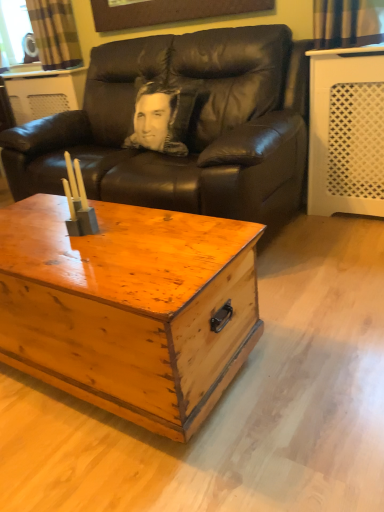
Question: Does wooden chest at center lie in front of black leather couch at center?

Choices:
 (A) yes
 (B) no

Answer: (A)

Question: From the image's perspective, does wooden chest at center appear lower than black leather couch at center?

Choices:
 (A) no
 (B) yes

Answer: (B)

Question: From a real-world perspective, does wooden chest at center stand above black leather couch at center?

Choices:
 (A) no
 (B) yes

Answer: (A)

Question: Is wooden chest at center further to the viewer compared to black leather couch at center?

Choices:
 (A) no
 (B) yes

Answer: (A)

Question: Is wooden chest at center outside of black leather couch at center?

Choices:
 (A) no
 (B) yes

Answer: (B)

Question: Can you confirm if wooden chest at center is bigger than black leather couch at center?

Choices:
 (A) no
 (B) yes

Answer: (A)

Question: Can you confirm if black leather couch at center is thinner than wooden chest at center?

Choices:
 (A) yes
 (B) no

Answer: (B)

Question: From a real-world perspective, does black leather couch at center sit lower than wooden chest at center?

Choices:
 (A) no
 (B) yes

Answer: (A)

Question: Is black leather couch at center outside wooden chest at center?

Choices:
 (A) yes
 (B) no

Answer: (A)

Question: From the image's perspective, is black leather couch at center over wooden chest at center?

Choices:
 (A) no
 (B) yes

Answer: (B)

Question: Can you confirm if black leather couch at center is wider than wooden chest at center?

Choices:
 (A) yes
 (B) no

Answer: (A)

Question: Could you tell me if black leather couch at center is facing wooden chest at center?

Choices:
 (A) yes
 (B) no

Answer: (A)

Question: Is plaid fabric curtain at upper left in front of black leather couch at center?

Choices:
 (A) yes
 (B) no

Answer: (B)